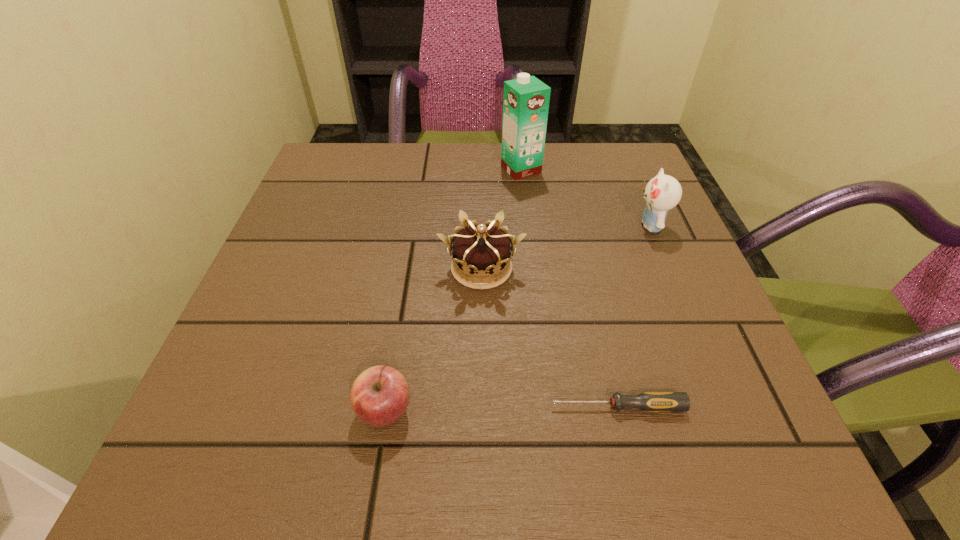
Identify the location of the farthest object. Image resolution: width=960 pixels, height=540 pixels. (526, 99).

Locate an element on the screen. The width and height of the screenshot is (960, 540). the tallest object is located at coordinates (526, 99).

The height and width of the screenshot is (540, 960). Identify the location of kitten. (662, 193).

Locate an element on the screen. The height and width of the screenshot is (540, 960). the rightmost object is located at coordinates (662, 193).

The width and height of the screenshot is (960, 540). I want to click on the third farthest object, so click(481, 250).

What are the coordinates of `the leftmost object` in the screenshot? It's located at (379, 396).

The width and height of the screenshot is (960, 540). In order to click on screwdriver in this screenshot , I will do pos(648,401).

Identify the location of free location located 0.070m on the left of the farthest object. (471, 170).

Find the location of `vacant area situated on the front-facing side of the rightmost object`. vacant area situated on the front-facing side of the rightmost object is located at coordinates (565, 225).

At what (x,y) coordinates should I click in order to perform the action: click on vacant space located on the front-facing side of the rightmost object. Please return your answer as a coordinate pair (x, y). Looking at the image, I should click on (610, 225).